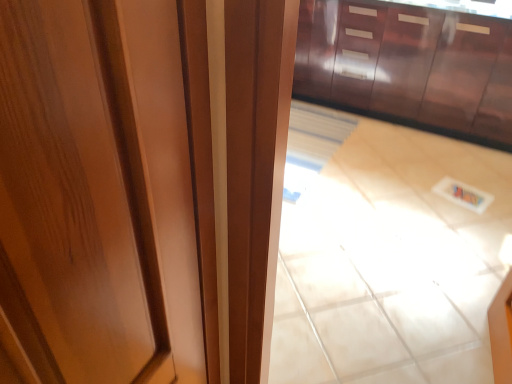
Question: Is glossy wood door at center at the right side of glossy wood cabinetry at upper center?

Choices:
 (A) yes
 (B) no

Answer: (B)

Question: Is glossy wood door at center located outside glossy wood cabinetry at upper center?

Choices:
 (A) no
 (B) yes

Answer: (B)

Question: Does glossy wood door at center have a lesser height compared to glossy wood cabinetry at upper center?

Choices:
 (A) yes
 (B) no

Answer: (B)

Question: Does glossy wood door at center turn towards glossy wood cabinetry at upper center?

Choices:
 (A) yes
 (B) no

Answer: (B)

Question: From a real-world perspective, is glossy wood door at center beneath glossy wood cabinetry at upper center?

Choices:
 (A) yes
 (B) no

Answer: (B)

Question: Do you think glossy wood door at center is within glossy wood cabinetry at upper center, or outside of it?

Choices:
 (A) inside
 (B) outside

Answer: (B)

Question: Visually, is glossy wood door at center positioned to the left or to the right of glossy wood cabinetry at upper center?

Choices:
 (A) left
 (B) right

Answer: (A)

Question: From a real-world perspective, is glossy wood door at center physically located above or below glossy wood cabinetry at upper center?

Choices:
 (A) below
 (B) above

Answer: (B)

Question: Considering the positions of glossy wood door at center and glossy wood cabinetry at upper center in the image, is glossy wood door at center taller or shorter than glossy wood cabinetry at upper center?

Choices:
 (A) short
 (B) tall

Answer: (B)

Question: Considering the positions of point (465, 345) and point (95, 145), is point (465, 345) closer or farther from the camera than point (95, 145)?

Choices:
 (A) farther
 (B) closer

Answer: (A)

Question: Considering their positions, is beige glossy tile at center located in front of or behind glossy wood door at center?

Choices:
 (A) front
 (B) behind

Answer: (B)

Question: Is beige glossy tile at center situated inside glossy wood door at center or outside?

Choices:
 (A) inside
 (B) outside

Answer: (B)

Question: Is beige glossy tile at center to the left or to the right of glossy wood door at center in the image?

Choices:
 (A) right
 (B) left

Answer: (A)

Question: Is glossy wood cabinetry at upper center spatially inside glossy wood door at center, or outside of it?

Choices:
 (A) inside
 (B) outside

Answer: (B)

Question: Considering the positions of point (336, 74) and point (291, 3), is point (336, 74) closer or farther from the camera than point (291, 3)?

Choices:
 (A) farther
 (B) closer

Answer: (A)